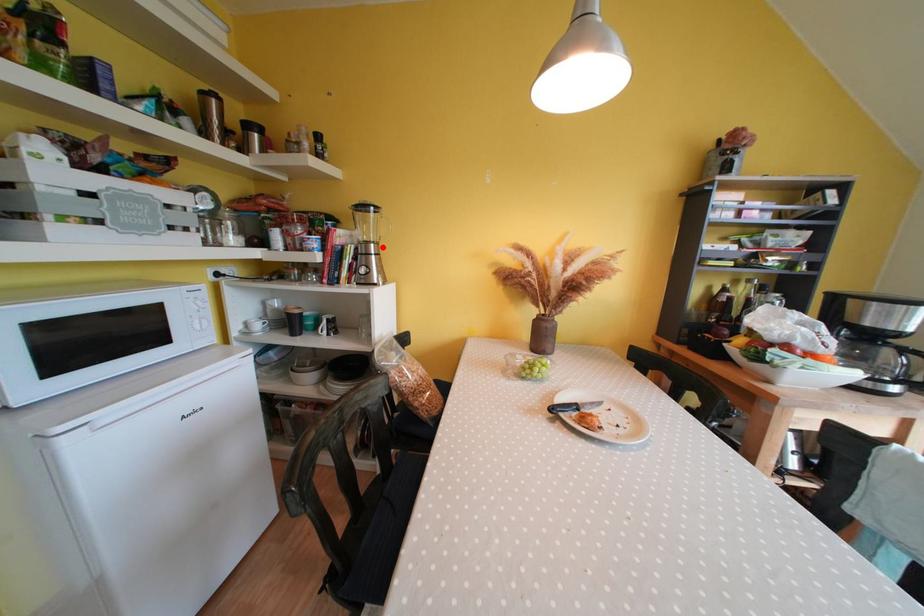
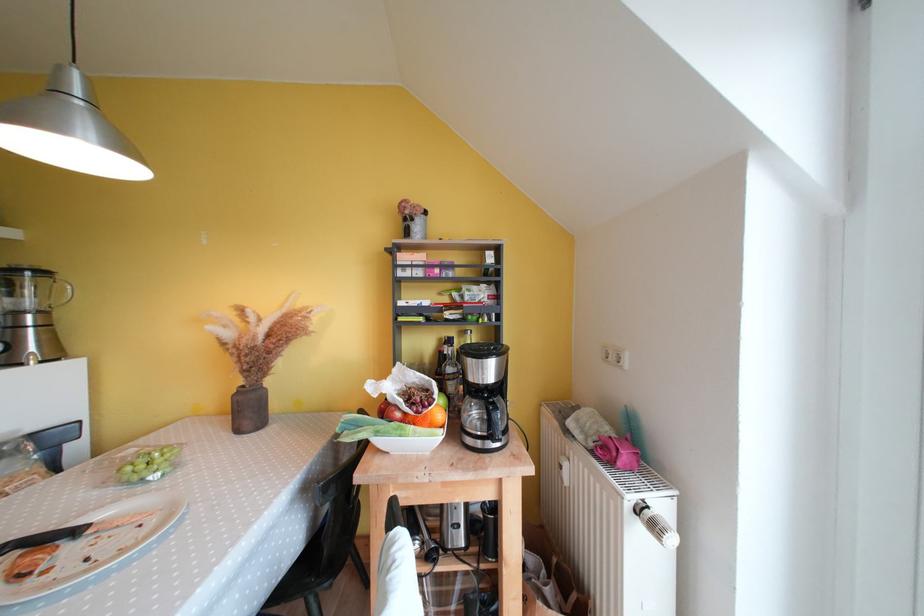
Locate, in the second image, the point that corresponds to the highlighted location in the first image.

(49, 315)